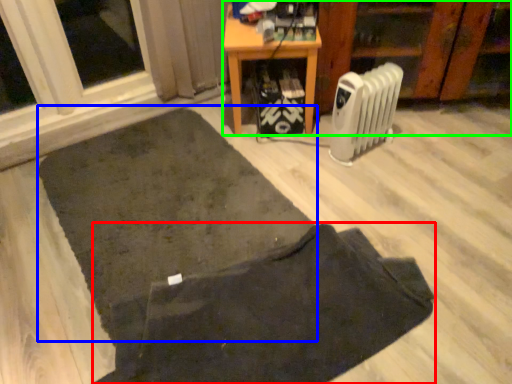
Question: Based on their relative distances, which object is farther from doormat (highlighted by a red box)? Choose from mat (highlighted by a blue box) and furniture (highlighted by a green box).

Choices:
 (A) mat
 (B) furniture

Answer: (B)